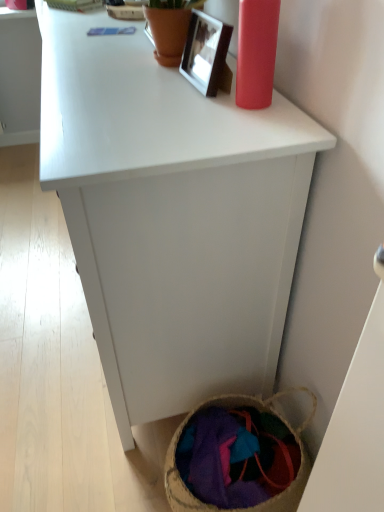
At what (x,y) coordinates should I click in order to perform the action: click on free space above white matte cabinet at center (from a real-world perspective). Please return your answer as a coordinate pair (x, y). The height and width of the screenshot is (512, 384). Looking at the image, I should click on (116, 55).